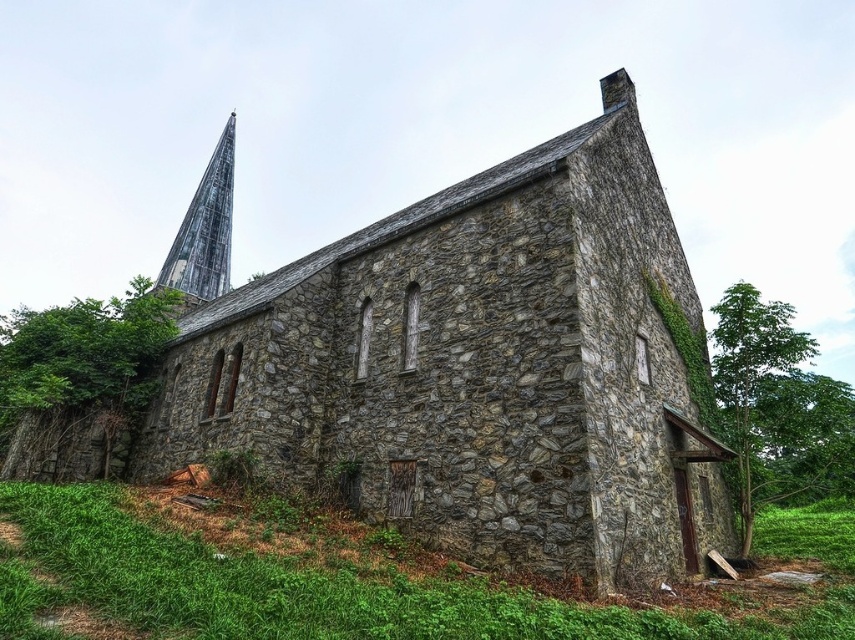
You are standing in front of the gray stone church at center and the weathered gray stone spire at upper left. Which one is positioned more to the left side of the scene?

The weathered gray stone spire at upper left is positioned more to the left side of the scene than the gray stone church at center.

You are standing at the point marked as point (313, 588) in the image. Looking towards the church, what kind of terrain are you standing on?

You are standing on green grass at lower left.

You are a tourist standing in front of the gray stone church at center and the weathered gray stone spire at upper left. Which object is positioned higher up in the image?

The weathered gray stone spire at upper left is positioned higher up in the image than the gray stone church at center.